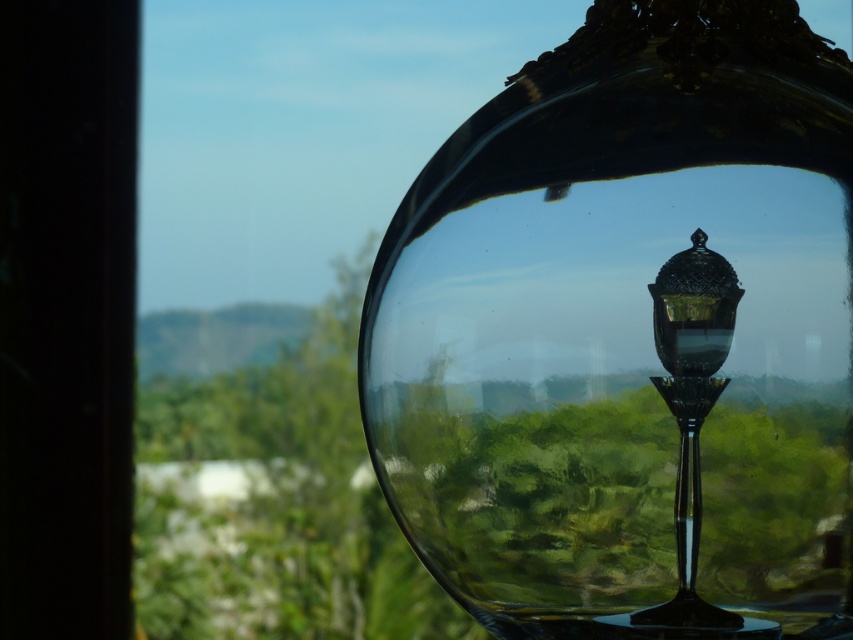
Question: Where is transparent glass bowl at center located in relation to black glass lamp post at center in the image?

Choices:
 (A) above
 (B) below

Answer: (A)

Question: Does transparent glass bowl at center lie in front of green leafy tree at center?

Choices:
 (A) no
 (B) yes

Answer: (B)

Question: Which object is the closest to the green leafy tree at center?

Choices:
 (A) black glass lamp post at center
 (B) transparent glass bowl at center

Answer: (B)

Question: Among these points, which one is nearest to the camera?

Choices:
 (A) (360, 368)
 (B) (152, 410)
 (C) (711, 380)

Answer: (C)

Question: Among these objects, which one is farthest from the camera?

Choices:
 (A) transparent glass bowl at center
 (B) black glass lamp post at center

Answer: (A)

Question: Is transparent glass bowl at center bigger than black glass lamp post at center?

Choices:
 (A) no
 (B) yes

Answer: (B)